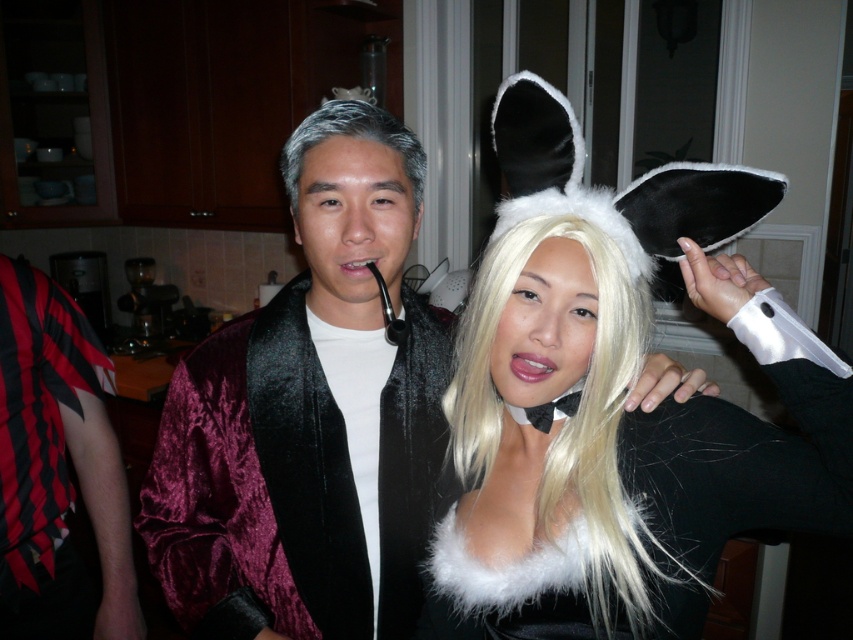
You are organizing a costume party and need to store the velvet burgundy jacket at center and the gray velvety wig at center in a closet. The closet has a shelf that can hold items up to 1 meter in width. Can both items fit side by side on the shelf?

The velvet burgundy jacket at center is bigger than the gray velvety wig at center. However, without specific measurements, it is impossible to determine if they can fit side by side on the shelf. Please provide more details about their individual sizes.